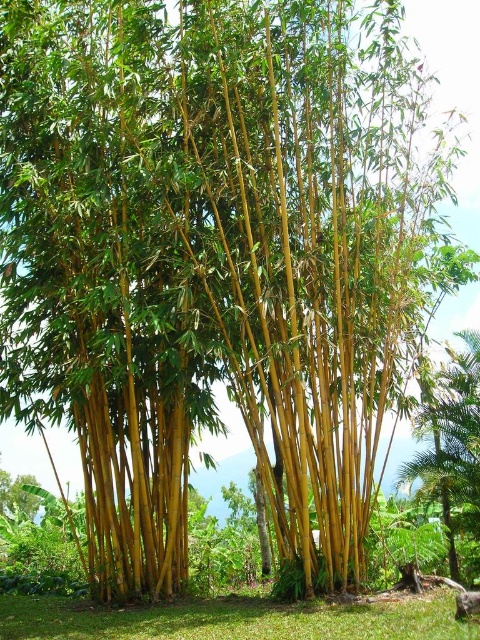
You are standing in the tropical bamboo grove shown in the image. You want to locate the green bamboo at lower right. Based on the coordinates provided, where should you look?

The green bamboo at lower right is located at point (452,444).

You are standing in the tropical bamboo grove and want to take a photo of both the green bamboo at lower right and the green leafy tree at lower left. Which object should you focus on first to ensure both are in focus?

You should focus on the green bamboo at lower right first because it is closer to you than the green leafy tree at lower left, so adjusting focus from near to far will help both be in focus.

You are standing in the tropical bamboo forest and want to locate two specific points marked in the scene. The first point is at coordinates point (427, 410) and the second is at point (16, 486). Which point is closer to you?

Point (427, 410) is in front of point (16, 486), so the first point is closer to you.